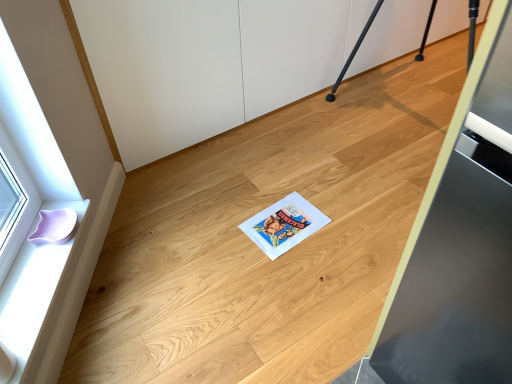
I want to click on vacant space underneath white paper comic book at center (from a real-world perspective), so click(282, 229).